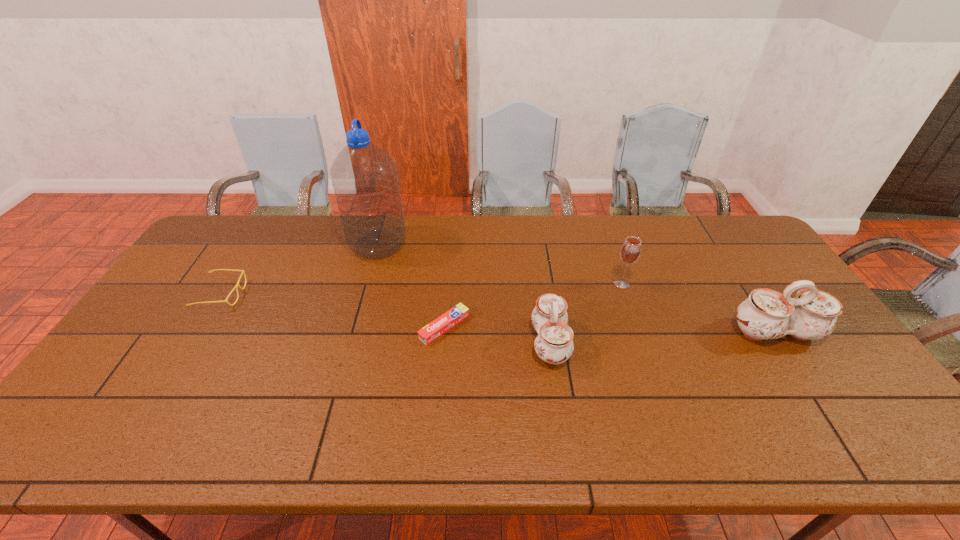
Locate an element on the screen. wineglass is located at coordinates (630, 251).

Where is `vacant space located by the handle of the shorter chinaware`? vacant space located by the handle of the shorter chinaware is located at coordinates (645, 343).

Image resolution: width=960 pixels, height=540 pixels. Identify the location of free spot located 0.120m by the handle of the taller chinaware. (811, 389).

I want to click on vacant space located on the right of the third object from left to right, so click(611, 327).

Image resolution: width=960 pixels, height=540 pixels. I want to click on vacant space located 0.050m in front of the lenses of the second shortest object, so click(x=258, y=294).

The width and height of the screenshot is (960, 540). I want to click on vacant space located on the left of the tallest object, so click(271, 245).

Identify the location of free space located 0.090m on the back of the second object from right to left. The image size is (960, 540). (613, 258).

Identify the location of object located at the far edge. (365, 180).

Find the location of a particular element. object present at the left edge is located at coordinates (237, 285).

Locate an element on the screen. Image resolution: width=960 pixels, height=540 pixels. object positioned at the right edge is located at coordinates (767, 314).